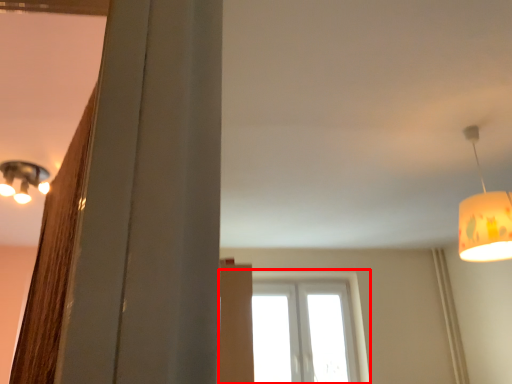
Question: From the image's perspective, what is the correct spatial positioning of window (annotated by the red box) in reference to lamp?

Choices:
 (A) above
 (B) below

Answer: (B)